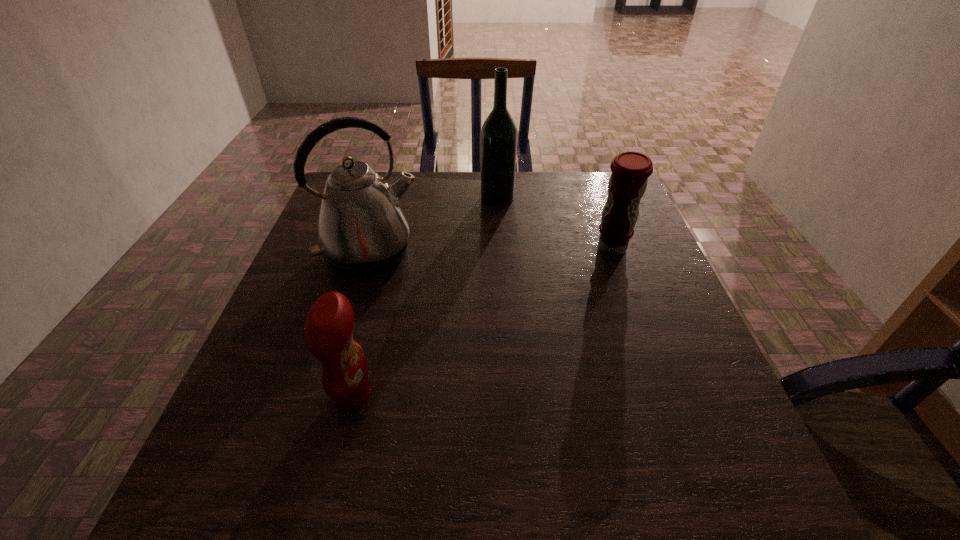
The height and width of the screenshot is (540, 960). I want to click on free point located 0.210m on the label side of the nearest object, so click(x=488, y=395).

Find the location of `object that is at the far edge`. object that is at the far edge is located at coordinates (499, 133).

Locate an element on the screen. object that is positioned at the left edge is located at coordinates (362, 231).

The width and height of the screenshot is (960, 540). Find the location of `object that is at the right edge`. object that is at the right edge is located at coordinates (630, 170).

At what (x,y) coordinates should I click in order to perform the action: click on vacant position at the far edge of the desktop. Please return your answer as a coordinate pair (x, y). This screenshot has width=960, height=540. Looking at the image, I should click on (407, 194).

I want to click on vacant space at the near edge of the desktop, so click(x=466, y=496).

Locate an element on the screen. The height and width of the screenshot is (540, 960). vacant area at the left edge of the desktop is located at coordinates (278, 361).

This screenshot has height=540, width=960. I want to click on vacant space at the right edge, so click(x=666, y=361).

Find the location of a particular element. The height and width of the screenshot is (540, 960). vacant space at the near left corner of the desktop is located at coordinates (221, 478).

This screenshot has height=540, width=960. I want to click on free space at the far right corner of the desktop, so click(x=585, y=199).